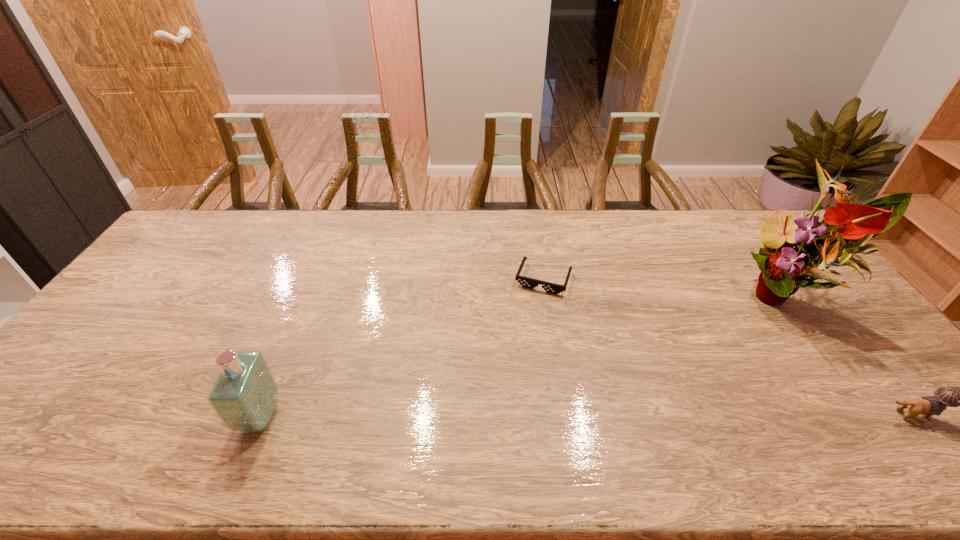
Image resolution: width=960 pixels, height=540 pixels. Find the location of `the second tallest object`. the second tallest object is located at coordinates click(244, 396).

Where is `perfume`? perfume is located at coordinates (244, 396).

I want to click on kitten, so click(948, 396).

Identify the location of the shortest object. [x=526, y=282].

Where is `the third object from right to left`? the third object from right to left is located at coordinates (526, 282).

Image resolution: width=960 pixels, height=540 pixels. I want to click on the tallest object, so click(x=845, y=229).

I want to click on free space located 0.050m on the front label of the perfume, so click(299, 416).

Where is `vacant space situated on the front-facing side of the shortest object`? vacant space situated on the front-facing side of the shortest object is located at coordinates (497, 404).

Where is `vacant region located on the front-facing side of the shortest object`? The image size is (960, 540). vacant region located on the front-facing side of the shortest object is located at coordinates (497, 404).

Locate an element on the screen. vacant region located 0.300m on the front-facing side of the shortest object is located at coordinates (509, 372).